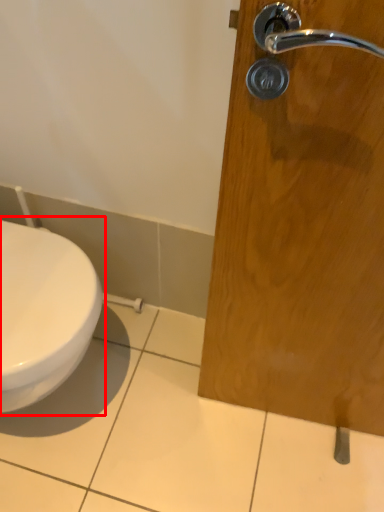
Question: Where is toilet (annotated by the red box) located in relation to door handle in the image?

Choices:
 (A) right
 (B) left

Answer: (B)